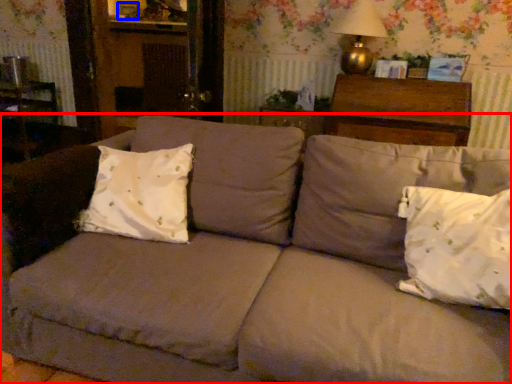
Question: Which object appears farthest to the camera in this image, studio couch (highlighted by a red box) or picture frame (highlighted by a blue box)?

Choices:
 (A) studio couch
 (B) picture frame

Answer: (B)